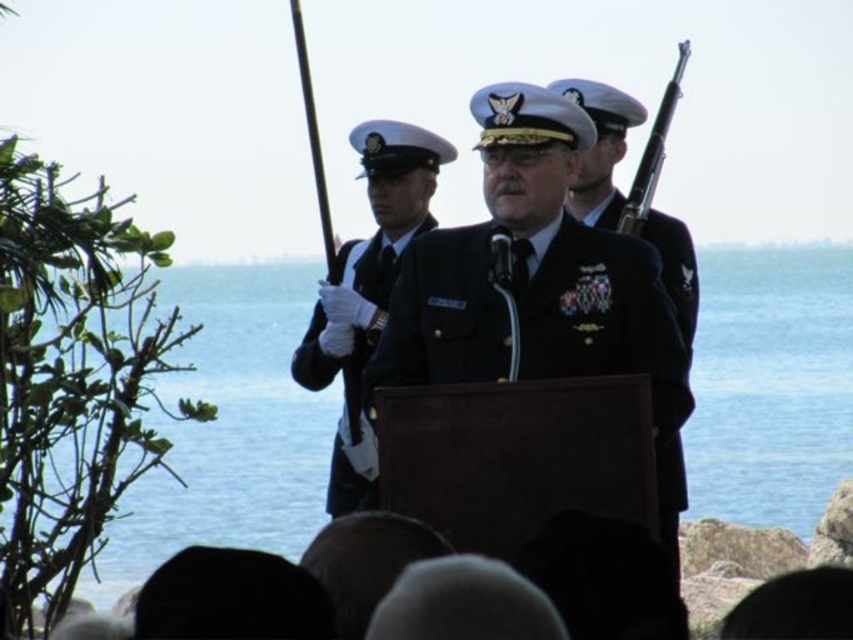
Can you confirm if blue water at center is bigger than black matte uniform at center?

Indeed, blue water at center has a larger size compared to black matte uniform at center.

Is blue water at center above black matte uniform at center?

No.

Between point (196, 278) and point (445, 262), which one is positioned behind?

The point (196, 278) is behind.

At what (x,y) coordinates should I click in order to perform the action: click on blue water at center. Please return your answer as a coordinate pair (x, y). Image resolution: width=853 pixels, height=640 pixels. Looking at the image, I should click on (230, 428).

Does point (286, 394) come behind point (640, 192)?

Yes, it is.

The height and width of the screenshot is (640, 853). Find the location of `blue water at center`. blue water at center is located at coordinates (230, 428).

Find the location of a particular element. blue water at center is located at coordinates (230, 428).

Is black matte uniform at center thinner than black glossy uniform at center?

In fact, black matte uniform at center might be wider than black glossy uniform at center.

The image size is (853, 640). I want to click on black matte uniform at center, so click(614, 330).

At what (x,y) coordinates should I click in order to perform the action: click on black matte uniform at center. Please return your answer as a coordinate pair (x, y). This screenshot has width=853, height=640. Looking at the image, I should click on (614, 330).